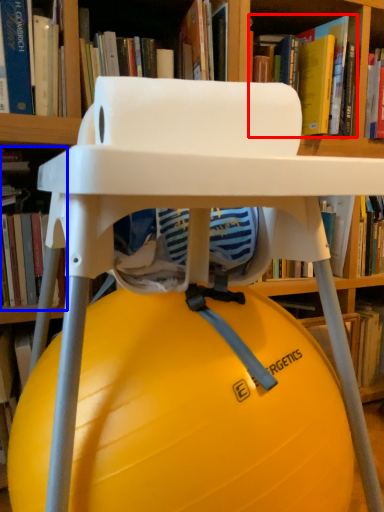
Question: Which point is closer to the camera, book (highlighted by a red box) or book (highlighted by a blue box)?

Choices:
 (A) book
 (B) book

Answer: (B)